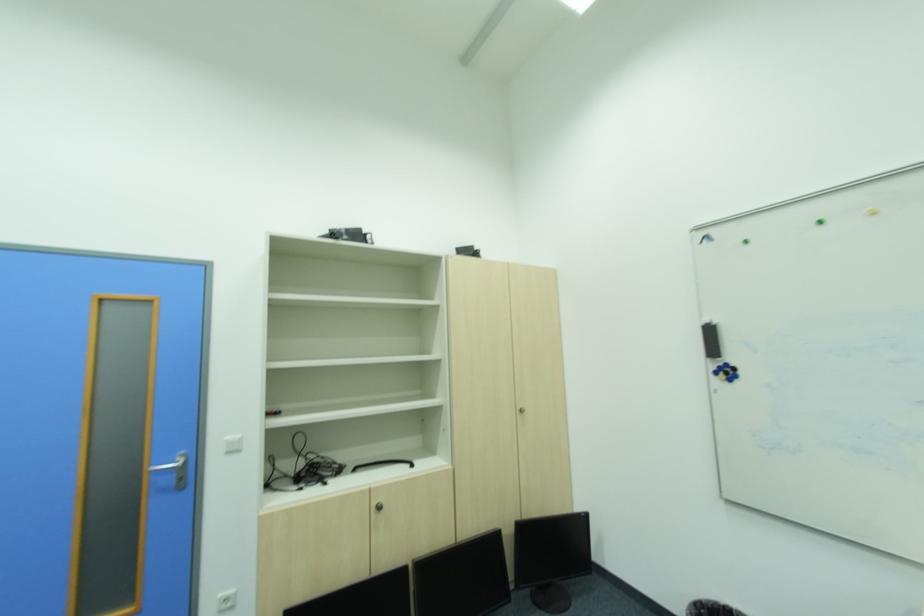
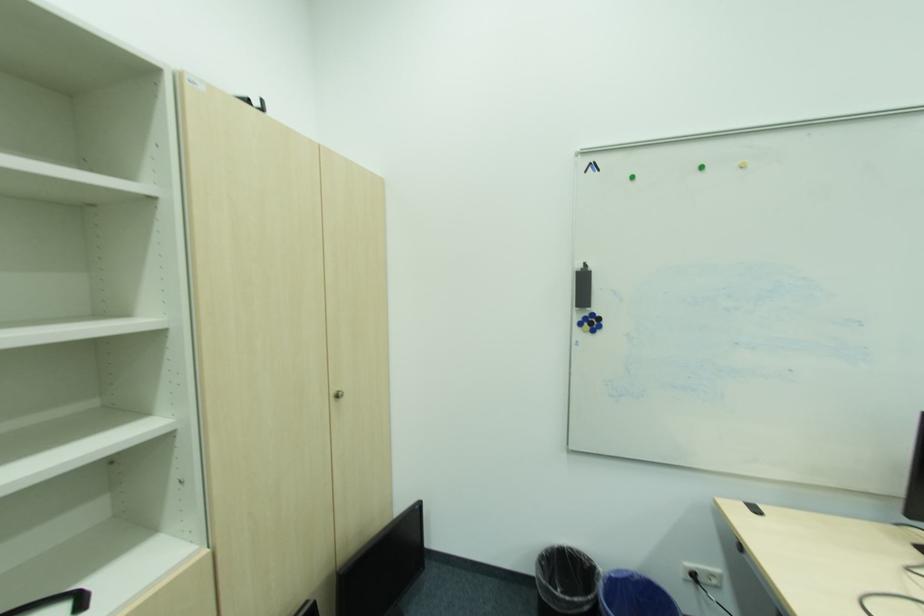
Question: How did the camera likely rotate?

Choices:
 (A) Left
 (B) Right
 (C) Up
 (D) Down

Answer: (B)